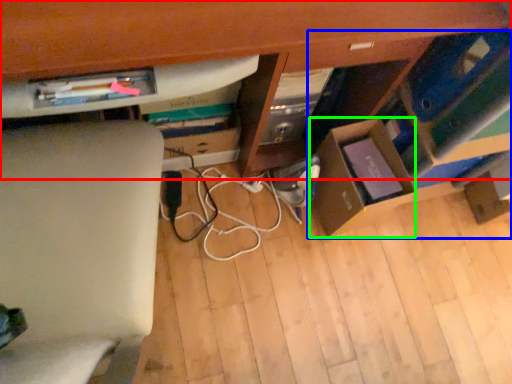
Question: Which is farther away from computer desk (highlighted by a red box)? shelf (highlighted by a blue box) or cardboard box (highlighted by a green box)?

Choices:
 (A) shelf
 (B) cardboard box

Answer: (B)